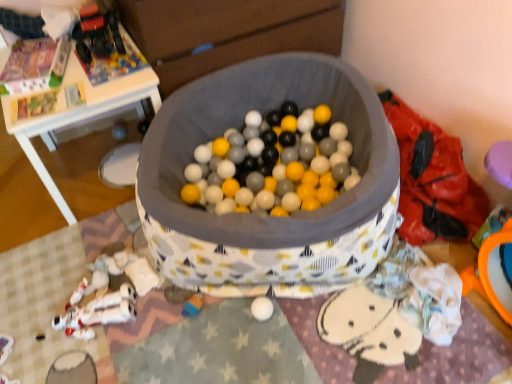
At what (x,y) coordinates should I click in order to perform the action: click on free spot in front of metallic plastic toy truck at upper left, which appears as the fourth toy when ordered from the bottom. Please return your answer as a coordinate pair (x, y). The height and width of the screenshot is (384, 512). Looking at the image, I should click on (98, 69).